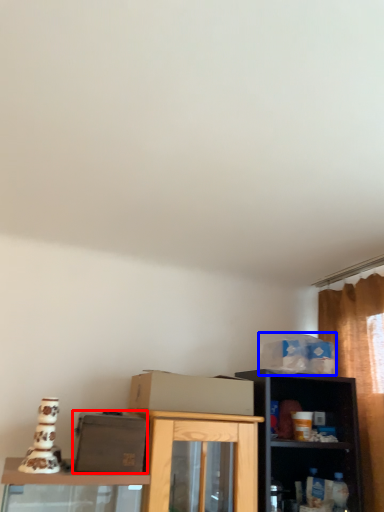
Question: Among these objects, which one is farthest to the camera, box (highlighted by a red box) or box (highlighted by a blue box)?

Choices:
 (A) box
 (B) box

Answer: (B)